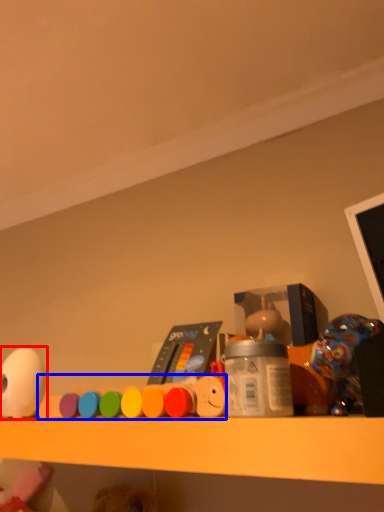
Question: Which of the following is the closest to the observer, toy (highlighted by a red box) or toy (highlighted by a blue box)?

Choices:
 (A) toy
 (B) toy

Answer: (B)